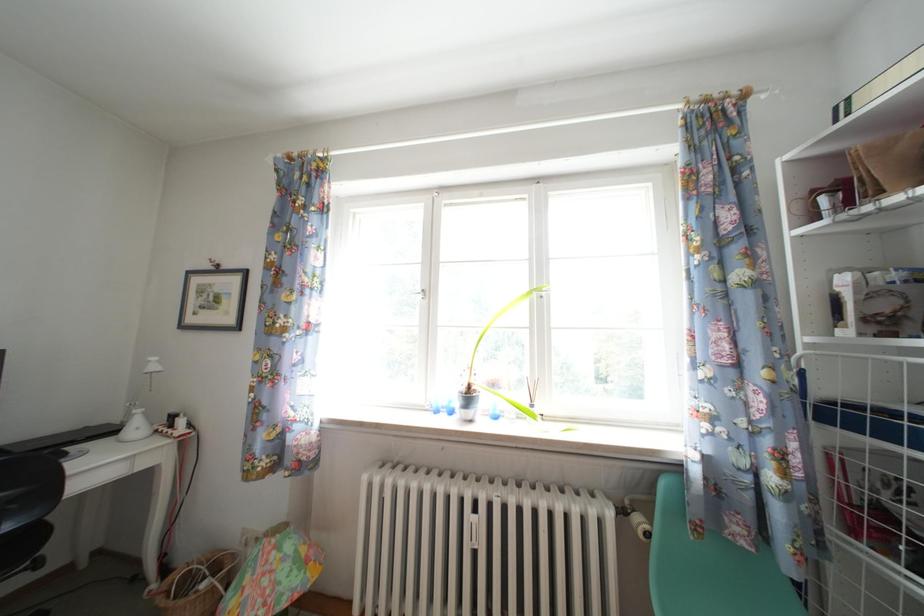
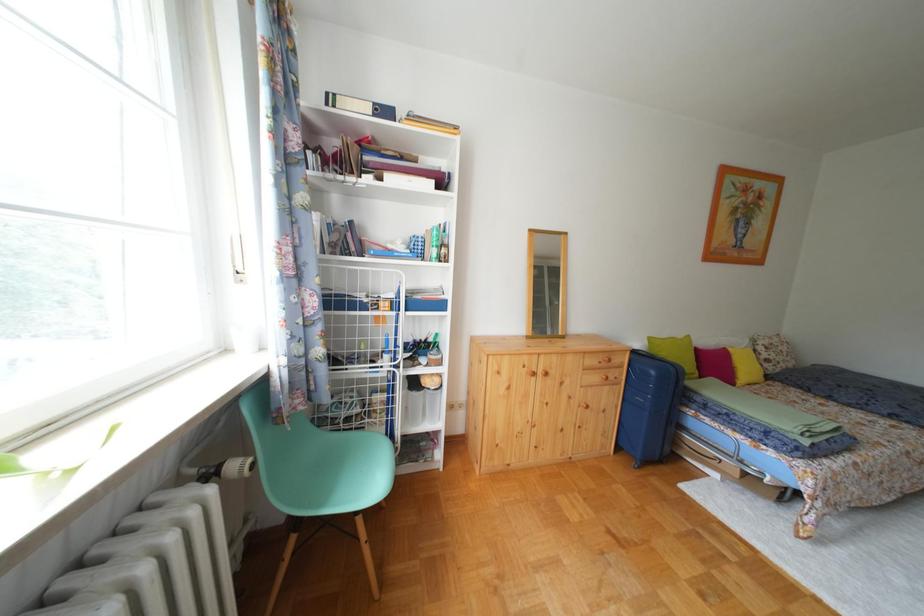
Question: The camera is either moving clockwise (left) or counter-clockwise (right) around the object. The first image is from the beginning of the video and the second image is from the end. Is the camera moving left or right when shooting the video?

Choices:
 (A) Left
 (B) Right

Answer: (A)